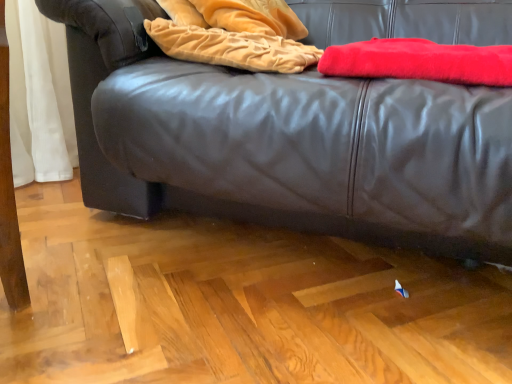
Question: From the image's perspective, is black leather couch at center under velvet gold blanket at upper center, which is the second blanket in right-to-left order?

Choices:
 (A) yes
 (B) no

Answer: (A)

Question: Is black leather couch at center in contact with velvet gold blanket at upper center, which appears as the 1th blanket when viewed from the left?

Choices:
 (A) yes
 (B) no

Answer: (B)

Question: Does black leather couch at center have a lesser height compared to velvet gold blanket at upper center, which is the second blanket in right-to-left order?

Choices:
 (A) no
 (B) yes

Answer: (A)

Question: Is black leather couch at center wider than velvet gold blanket at upper center, which is the second blanket in right-to-left order?

Choices:
 (A) yes
 (B) no

Answer: (A)

Question: Considering the relative positions of black leather couch at center and velvet gold blanket at upper center, which is the second blanket in right-to-left order, in the image provided, is black leather couch at center to the left of velvet gold blanket at upper center, which is the second blanket in right-to-left order, from the viewer's perspective?

Choices:
 (A) yes
 (B) no

Answer: (B)

Question: Is black leather couch at center taller than velvet gold blanket at upper center, which appears as the 1th blanket when viewed from the left?

Choices:
 (A) yes
 (B) no

Answer: (A)

Question: Is velvet gold blanket at upper center, which appears as the 1th blanket when viewed from the left, further to camera compared to red fuzzy blanket at upper right, the 1th blanket from the right?

Choices:
 (A) yes
 (B) no

Answer: (A)

Question: Can red fuzzy blanket at upper right, the 1th blanket from the right, be found inside velvet gold blanket at upper center, which appears as the 1th blanket when viewed from the left?

Choices:
 (A) yes
 (B) no

Answer: (B)

Question: Does velvet gold blanket at upper center, which appears as the 1th blanket when viewed from the left, come in front of red fuzzy blanket at upper right, the 1th blanket from the right?

Choices:
 (A) no
 (B) yes

Answer: (A)

Question: Is velvet gold blanket at upper center, which is the second blanket in right-to-left order, wider than red fuzzy blanket at upper right, the 1th blanket from the right?

Choices:
 (A) no
 (B) yes

Answer: (A)

Question: Does velvet gold blanket at upper center, which appears as the 1th blanket when viewed from the left, have a lesser height compared to red fuzzy blanket at upper right, the 1th blanket from the right?

Choices:
 (A) yes
 (B) no

Answer: (B)

Question: Can you confirm if velvet gold blanket at upper center, which is the second blanket in right-to-left order, is thinner than red fuzzy blanket at upper right, the 2th blanket when ordered from left to right?

Choices:
 (A) yes
 (B) no

Answer: (A)

Question: Would you say red fuzzy blanket at upper right, the 1th blanket from the right, contains velvet gold blanket at upper center, which appears as the 1th blanket when viewed from the left?

Choices:
 (A) no
 (B) yes

Answer: (A)